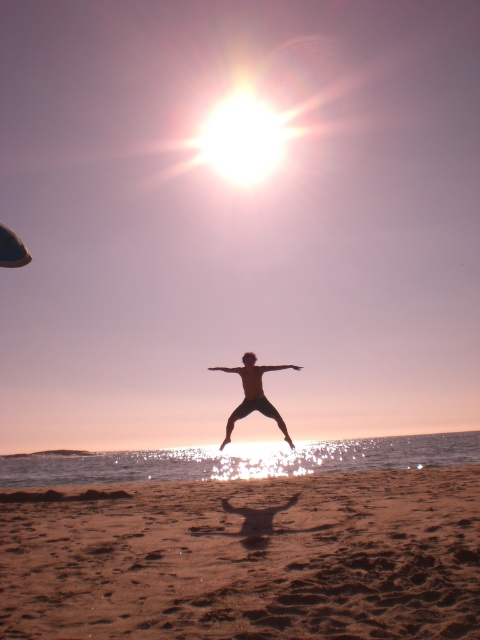
You are standing on the beach and see two points in the scene. The first point is at coordinates point (46,556) and the second is at point (252,392). Which point is closer to you?

Point (46,556) is closer to the camera than point (252,392), so the first point is closer to you.

You are a photographer trying to capture the sunset at the beach. You see the brown sandy beach at lower center and the black matte person at center. Which object occupies more horizontal space in the image?

The brown sandy beach at lower center occupies more horizontal space than the black matte person at center because its width is larger.

You are standing on the brown sandy beach at lower center and want to reach the black matte person at center. In which direction should you move?

You should move to the right because the brown sandy beach at lower center is to the left of the black matte person at center, so moving right will bring you closer to the person.